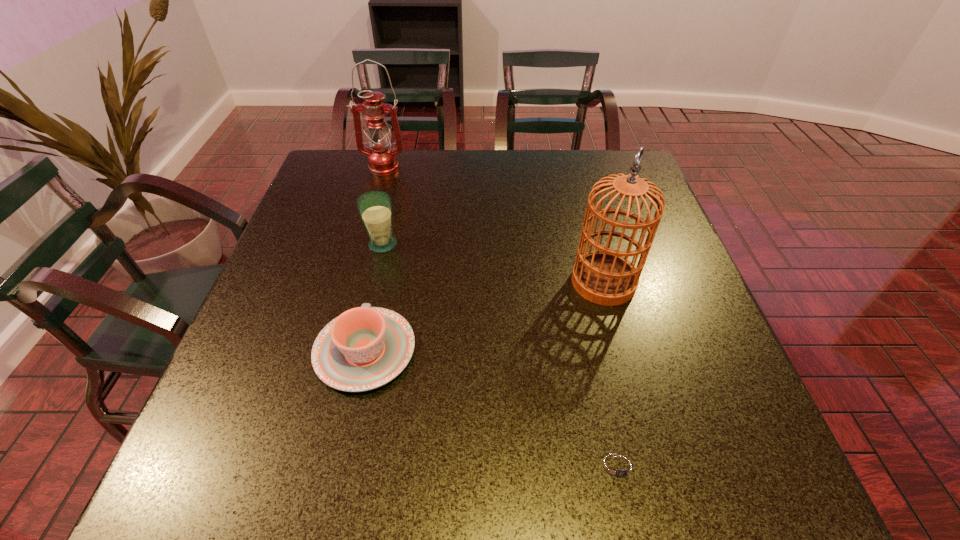
At what (x,y) coordinates should I click in order to perform the action: click on vacant space at the far edge of the desktop. Please return your answer as a coordinate pair (x, y). Image resolution: width=960 pixels, height=540 pixels. Looking at the image, I should click on (468, 166).

The width and height of the screenshot is (960, 540). Find the location of `vacant space at the near edge of the desktop`. vacant space at the near edge of the desktop is located at coordinates (468, 466).

Where is `free space at the left edge of the desktop`? This screenshot has width=960, height=540. free space at the left edge of the desktop is located at coordinates 292,391.

What are the coordinates of `free location at the right edge of the desktop` in the screenshot? It's located at [x=706, y=419].

The height and width of the screenshot is (540, 960). In order to click on vacant space at the far right corner of the desktop in this screenshot , I will do `click(614, 155)`.

The width and height of the screenshot is (960, 540). Find the location of `free space at the near right corner`. free space at the near right corner is located at coordinates (703, 464).

This screenshot has width=960, height=540. I want to click on vacant area that lies between the fourth farthest object and the farthest object, so click(374, 259).

You are a GUI agent. You are given a task and a screenshot of the screen. Output one action in this format:
    pyautogui.click(x=<x>, y=<y>)
    Task: Click on the free area in between the third nearest object and the shortest object
    
    Given the screenshot: What is the action you would take?
    pyautogui.click(x=612, y=374)

At what (x,y) coordinates should I click in order to perform the action: click on unoccupied position between the birdcage and the oil lamp. Please return your answer as a coordinate pair (x, y). Looking at the image, I should click on (493, 225).

Identify the location of empty space between the farthest object and the second nearest object. (374, 259).